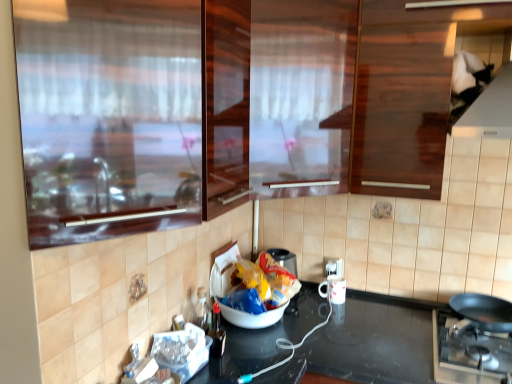
Question: Considering the relative sizes of white plastic electric outlet at lower right and white glossy mug at lower center in the image provided, is white plastic electric outlet at lower right smaller than white glossy mug at lower center?

Choices:
 (A) no
 (B) yes

Answer: (B)

Question: Is white plastic electric outlet at lower right turned away from white glossy mug at lower center?

Choices:
 (A) yes
 (B) no

Answer: (B)

Question: Is white plastic electric outlet at lower right not within white glossy mug at lower center?

Choices:
 (A) yes
 (B) no

Answer: (A)

Question: From a real-world perspective, is white plastic electric outlet at lower right over white glossy mug at lower center?

Choices:
 (A) yes
 (B) no

Answer: (A)

Question: Is white plastic electric outlet at lower right far from white glossy mug at lower center?

Choices:
 (A) no
 (B) yes

Answer: (A)

Question: From the image's perspective, is black glossy countertop at center located above or below white plastic electric outlet at lower right?

Choices:
 (A) below
 (B) above

Answer: (A)

Question: Is black glossy countertop at center bigger or smaller than white plastic electric outlet at lower right?

Choices:
 (A) small
 (B) big

Answer: (B)

Question: Considering their positions, is black glossy countertop at center located in front of or behind white plastic electric outlet at lower right?

Choices:
 (A) front
 (B) behind

Answer: (A)

Question: From a real-world perspective, relative to white plastic electric outlet at lower right, is black glossy countertop at center vertically above or below?

Choices:
 (A) above
 (B) below

Answer: (B)

Question: Considering their positions, is transparent glass door at upper left, positioned as the 1th glass door in front-to-back order, located in front of or behind brown glossy cabinet at upper center?

Choices:
 (A) front
 (B) behind

Answer: (B)

Question: Based on their positions, is transparent glass door at upper left, which ranks as the second glass door in back-to-front order, located to the left or right of brown glossy cabinet at upper center?

Choices:
 (A) right
 (B) left

Answer: (B)

Question: From a real-world perspective, is transparent glass door at upper left, positioned as the 1th glass door in front-to-back order, positioned above or below brown glossy cabinet at upper center?

Choices:
 (A) above
 (B) below

Answer: (B)

Question: Does point (42, 105) appear closer or farther from the camera than point (216, 77)?

Choices:
 (A) closer
 (B) farther

Answer: (A)

Question: From the image's perspective, is transparent glossy glass door at upper center, positioned as the second glass door in front-to-back order, above or below brown glossy cabinet at upper center?

Choices:
 (A) below
 (B) above

Answer: (B)

Question: Based on their sizes in the image, would you say transparent glossy glass door at upper center, the 1th glass door positioned from the back, is bigger or smaller than brown glossy cabinet at upper center?

Choices:
 (A) big
 (B) small

Answer: (B)